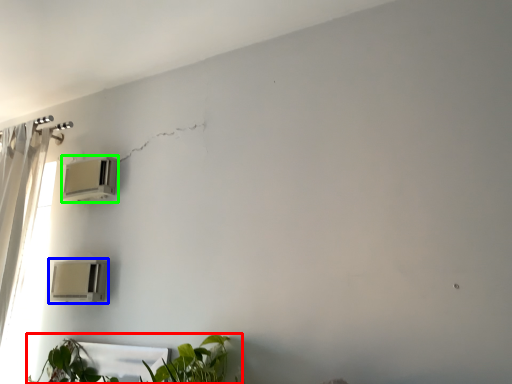
Question: Which object is positioned closest to houseplant (highlighted by a red box)? Select from air conditioning (highlighted by a blue box) and air conditioning (highlighted by a green box).

Choices:
 (A) air conditioning
 (B) air conditioning

Answer: (A)